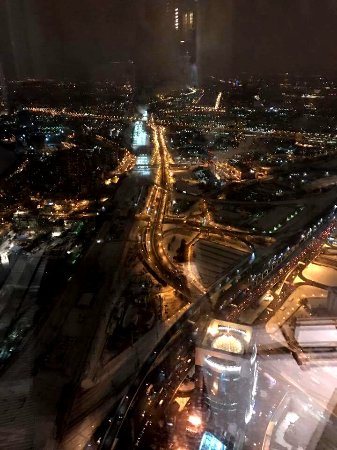
This screenshot has height=450, width=337. Find the location of `white lights`. white lights is located at coordinates (142, 159), (138, 139), (143, 171), (144, 113), (144, 117).